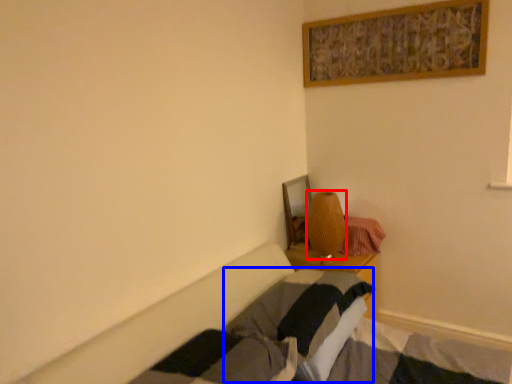
Question: Which of the following is the farthest to the observer, lamp (highlighted by a red box) or pillow (highlighted by a blue box)?

Choices:
 (A) lamp
 (B) pillow

Answer: (A)